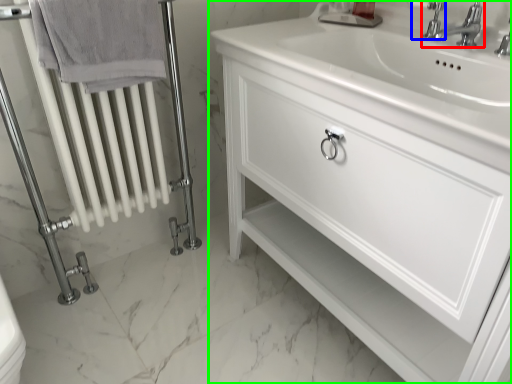
Question: Based on their relative distances, which object is farther from tap (highlighted by a red box)? Choose from plumbing fixture (highlighted by a blue box) and bathroom cabinet (highlighted by a green box).

Choices:
 (A) plumbing fixture
 (B) bathroom cabinet

Answer: (B)